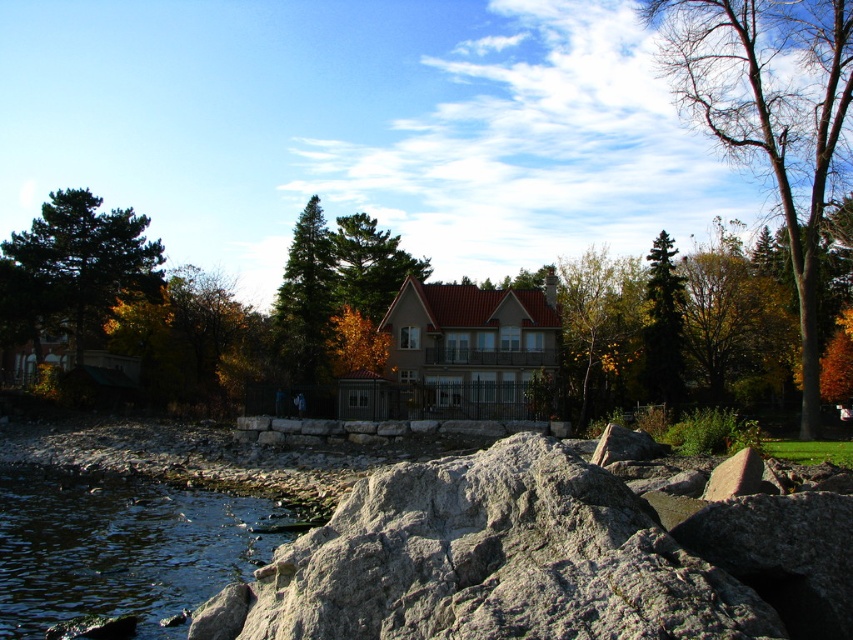
Question: Which of the following is the farthest from the observer?

Choices:
 (A) (219, 515)
 (B) (654, 349)

Answer: (B)

Question: Which object is closer to the camera taking this photo?

Choices:
 (A) brown textured tree at upper right
 (B) clear water at lower left
 (C) green matte tree at center

Answer: (B)

Question: Can you confirm if gray rough rock at lower left is bigger than green coniferous tree at upper right?

Choices:
 (A) yes
 (B) no

Answer: (B)

Question: Can you confirm if gray rough rock at lower left is positioned above clear water at lower left?

Choices:
 (A) no
 (B) yes

Answer: (B)

Question: Is clear water at lower left smaller than green coniferous tree at upper right?

Choices:
 (A) no
 (B) yes

Answer: (B)

Question: Which of the following is the closest to the observer?

Choices:
 (A) (479, 506)
 (B) (57, 260)

Answer: (A)